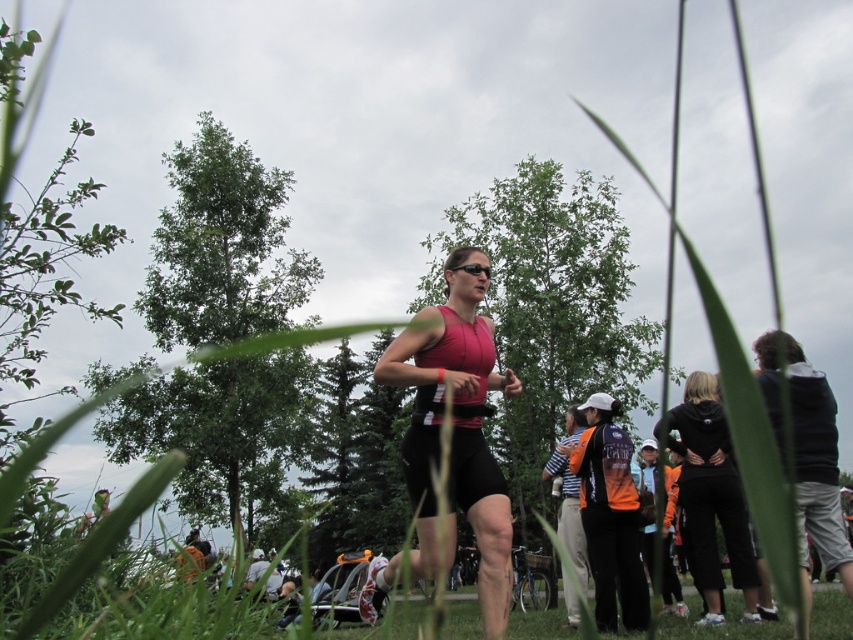
Which of these two, matte pink tank top at center or black matte hoodie at lower right, stands shorter?

black matte hoodie at lower right

In the scene shown: Is matte pink tank top at center to the right of black matte hoodie at lower right from the viewer's perspective?

Incorrect, matte pink tank top at center is not on the right side of black matte hoodie at lower right.

This screenshot has height=640, width=853. I want to click on matte pink tank top at center, so click(x=456, y=429).